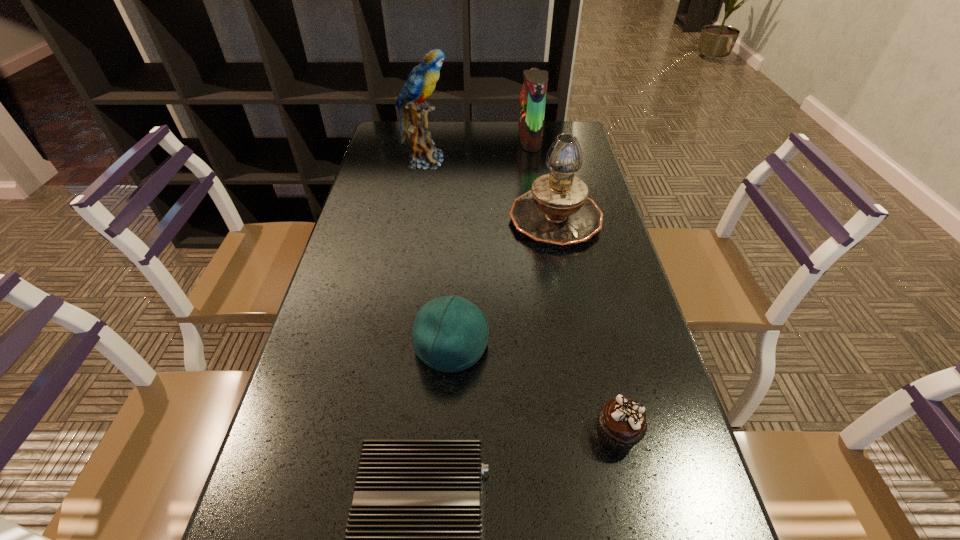
This screenshot has width=960, height=540. In order to click on free space located at the face of the right parrot in this screenshot , I will do `click(501, 140)`.

This screenshot has height=540, width=960. I want to click on vacant area situated 0.290m at the face of the right parrot, so click(x=438, y=140).

This screenshot has width=960, height=540. Find the location of `free space located on the back of the third shortest object`. free space located on the back of the third shortest object is located at coordinates (459, 217).

At what (x,y) coordinates should I click in order to perform the action: click on free spot located 0.230m on the left of the cupcake. Please return your answer as a coordinate pair (x, y). This screenshot has width=960, height=540. Looking at the image, I should click on (468, 434).

The width and height of the screenshot is (960, 540). Find the location of `object located in the left edge section of the desktop`. object located in the left edge section of the desktop is located at coordinates (420, 83).

Identify the location of oil lamp that is positioned at the right edge. (557, 211).

This screenshot has height=540, width=960. I want to click on parrot present at the right edge, so click(533, 94).

You are a GUI agent. You are given a task and a screenshot of the screen. Output one action in this format:
    pyautogui.click(x=<x>, y=<y>)
    Task: Click on the cupcake that is at the right edge
    This screenshot has width=960, height=540.
    Given the screenshot: What is the action you would take?
    pyautogui.click(x=621, y=423)

The image size is (960, 540). Find the location of `object that is at the far left corner`. object that is at the far left corner is located at coordinates (420, 83).

The width and height of the screenshot is (960, 540). I want to click on object that is at the far right corner, so pos(533,94).